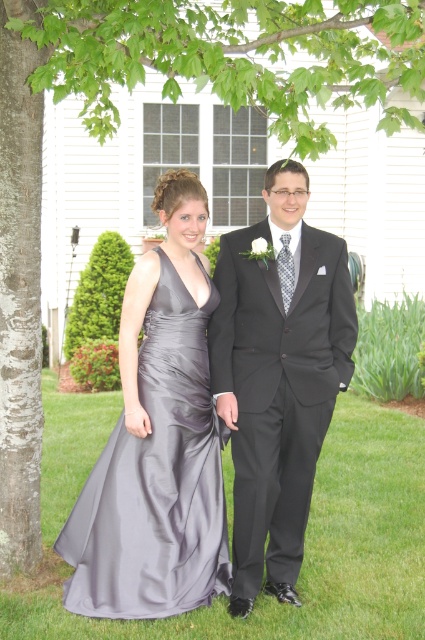
Can you confirm if silky gray dress at center is bigger than shiny black suit at center?

No.

Does point (337, 406) lie behind point (218, 321)?

Yes, it is.

Identify the location of silky gray dress at center. (305, 552).

Identify the location of silky gray dress at center. Image resolution: width=425 pixels, height=640 pixels. (305, 552).

Does point (115, 426) come behind point (218, 440)?

That is True.

Which of these two, satin dress at center or satin dress at left, stands taller?

satin dress at center is taller.

At what (x,y) coordinates should I click in order to perform the action: click on satin dress at center. Please return your answer as a coordinate pair (x, y). The width and height of the screenshot is (425, 640). Looking at the image, I should click on (204, 408).

At what (x,y) coordinates should I click in order to perform the action: click on satin dress at center. Please return your answer as a coordinate pair (x, y). The height and width of the screenshot is (640, 425). Looking at the image, I should click on (204, 408).

Between silky gray dress at center and satin dress at left, which one has more height?

satin dress at left

Locate an element on the screen. This screenshot has height=640, width=425. silky gray dress at center is located at coordinates [305, 552].

The image size is (425, 640). I want to click on silky gray dress at center, so click(305, 552).